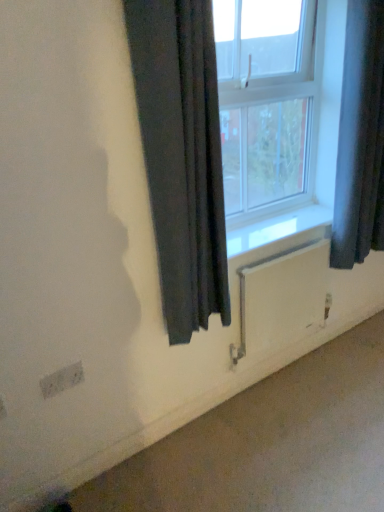
Locate an element on the screen. The height and width of the screenshot is (512, 384). vacant area situated below black fabric curtain at center, the second curtain in the right-to-left sequence (from a real-world perspective) is located at coordinates (192, 421).